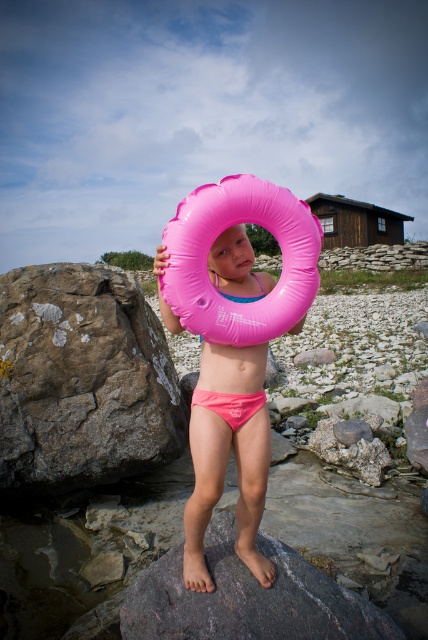
Question: Which point is farther to the camera?

Choices:
 (A) (238, 278)
 (B) (125, 460)
 (C) (225, 396)

Answer: (B)

Question: Which object is closer to the camera taking this photo?

Choices:
 (A) pink matte bikini at center
 (B) gray rough rock at left

Answer: (A)

Question: Can you confirm if gray rough rock at left is smaller than pink matte bikini at center?

Choices:
 (A) yes
 (B) no

Answer: (B)

Question: Can you confirm if gray rough rock at left is thinner than pink matte bikini at center?

Choices:
 (A) yes
 (B) no

Answer: (B)

Question: Can you confirm if pink rubber ring at center is positioned to the left of pink matte bikini at center?

Choices:
 (A) no
 (B) yes

Answer: (B)

Question: Estimate the real-world distances between objects in this image. Which object is closer to the pink rubber ring at center?

Choices:
 (A) pink matte bikini at center
 (B) gray rough rock at left

Answer: (A)